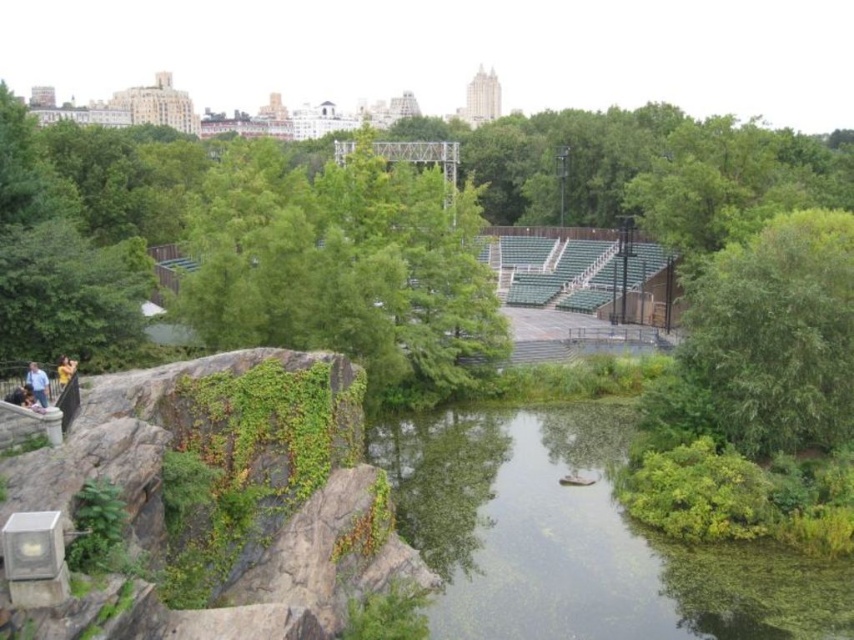
Identify the location of green leafy tree at center. (344, 268).

Can you confirm if green leafy tree at center is positioned above green leafy tree at center-right?

Indeed, green leafy tree at center is positioned over green leafy tree at center-right.

Measure the distance between green leafy tree at center and camera.

green leafy tree at center and camera are 36.05 meters apart from each other.

I want to click on green leafy tree at center, so click(344, 268).

Is green algae-covered water at center to the right of green leafy tree at center from the viewer's perspective?

Yes, green algae-covered water at center is to the right of green leafy tree at center.

Where is `green algae-covered water at center`? green algae-covered water at center is located at coordinates (578, 540).

Between point (588, 534) and point (230, 147), which one is positioned behind?

Point (230, 147)

This screenshot has height=640, width=854. I want to click on green algae-covered water at center, so click(x=578, y=540).

Image resolution: width=854 pixels, height=640 pixels. Identify the location of green leafy tree at center-right. (768, 340).

Is green leafy tree at center-right to the right of blue shirt at left from the viewer's perspective?

Yes, green leafy tree at center-right is to the right of blue shirt at left.

Between point (774, 403) and point (34, 378), which one is positioned in front?

Point (34, 378) is more forward.

Find the location of `green leafy tree at center-right`. green leafy tree at center-right is located at coordinates (768, 340).